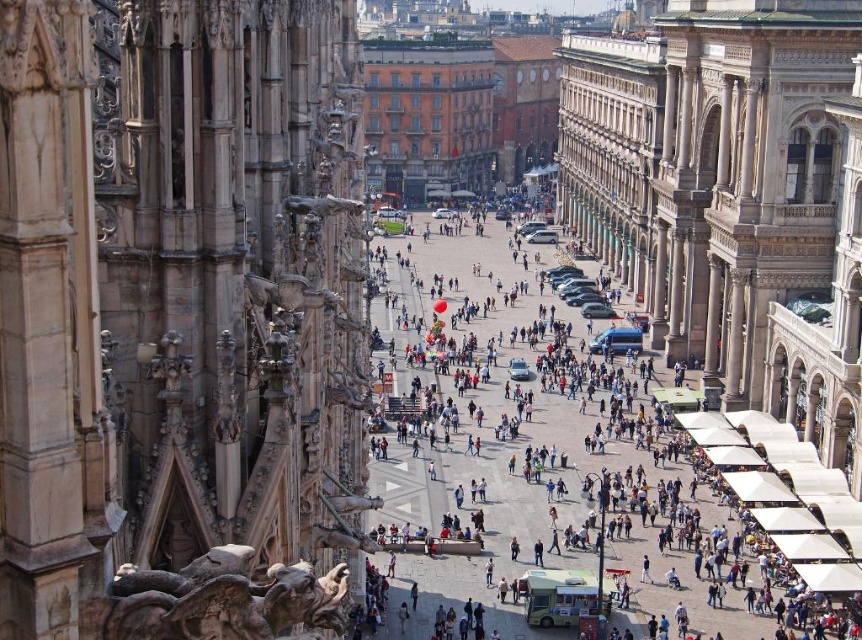
You are an architect planning to install a new decorative element in the square. The beige stone gargoyle at left and the matte white tent at center are both potential locations. Which object has a smaller width, and thus might be better suited for placing a smaller decorative item?

The beige stone gargoyle at left has a smaller width than the matte white tent at center, so it might be better suited for placing a smaller decorative item.

You are standing at the center of the square and want to locate the beige stone gargoyle at left. In which direction should you look to find it?

You should look to your left to find the beige stone gargoyle at left since it is located at point (180, 320), which is to the left side of the scene.

You are standing on a high platform overlooking the square. You see the beige stone gargoyle at left and the matte white tent at center. Which object is nearer to you?

The beige stone gargoyle at left is closer to the viewer than the matte white tent at center.